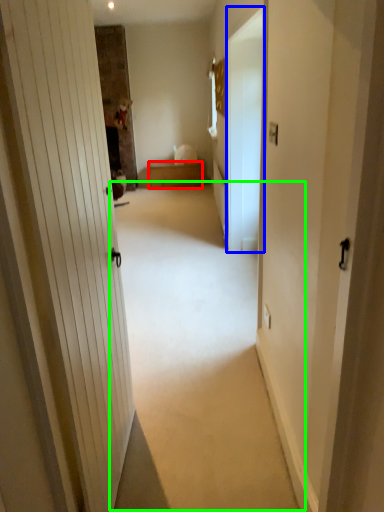
Question: Estimate the real-world distances between objects in this image. Which object is farther from furniture (highlighted by a red box), screen door (highlighted by a blue box) or plain (highlighted by a green box)?

Choices:
 (A) screen door
 (B) plain

Answer: (B)